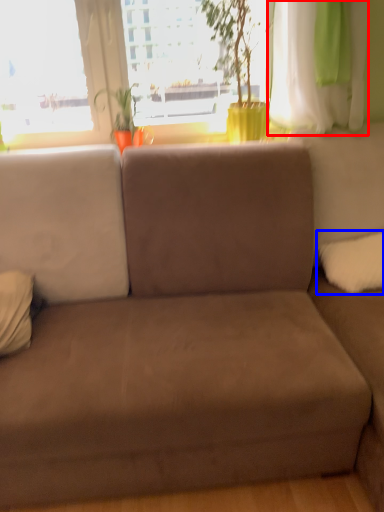
Question: Which object is closer to the camera taking this photo, curtain (highlighted by a red box) or pillow (highlighted by a blue box)?

Choices:
 (A) curtain
 (B) pillow

Answer: (A)